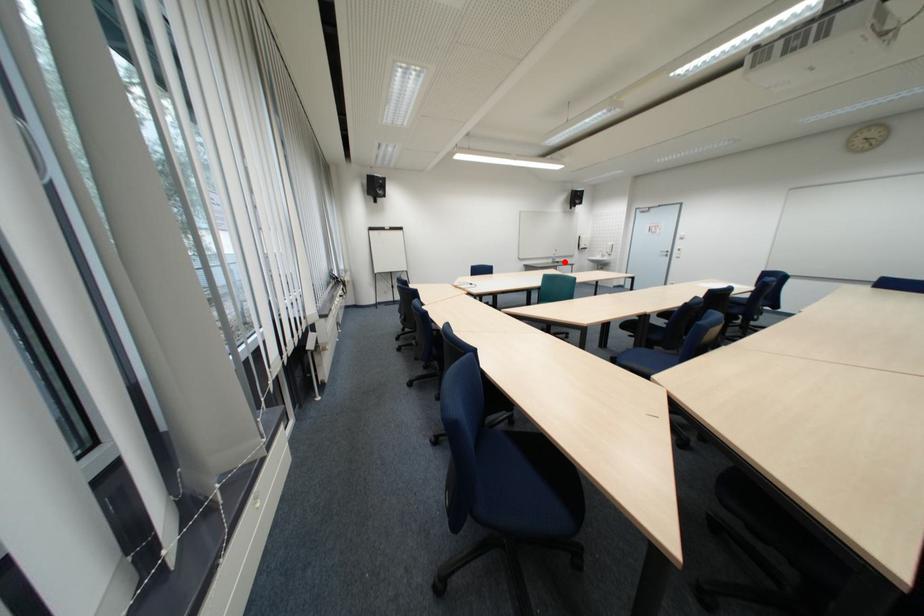
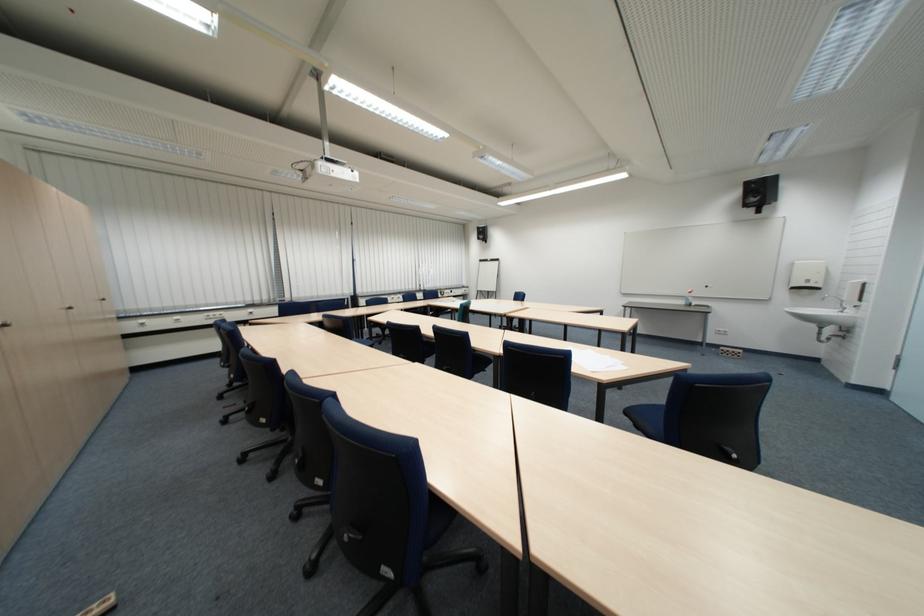
The point at the highlighted location is marked in the first image. Where is the corresponding point in the second image?

(696, 302)